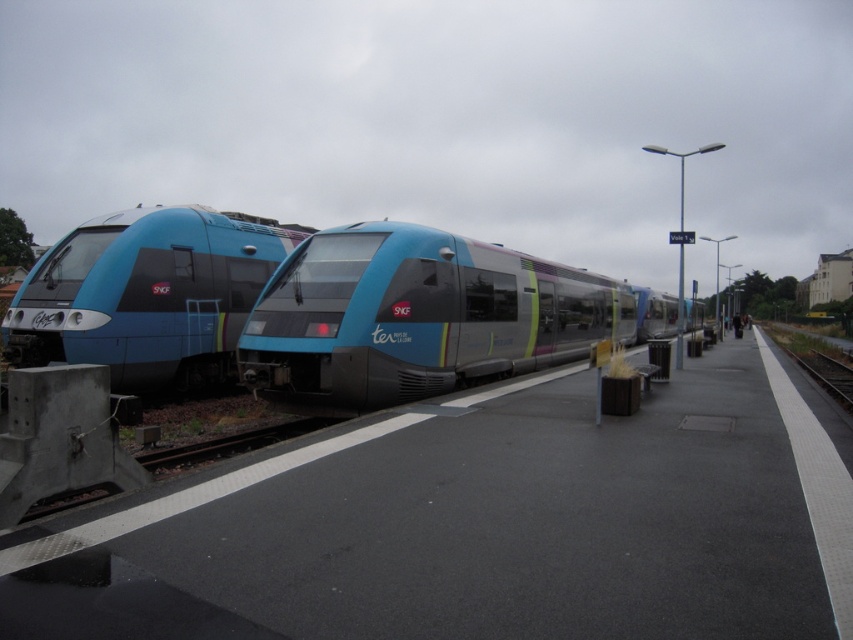
Does metallic silver train at center have a greater width compared to matte blue train at left?

Yes.

Is metallic silver train at center bigger than matte blue train at left?

Actually, metallic silver train at center might be smaller than matte blue train at left.

Identify the location of metallic silver train at center. (416, 316).

Where is `metallic silver train at center`? The height and width of the screenshot is (640, 853). metallic silver train at center is located at coordinates (416, 316).